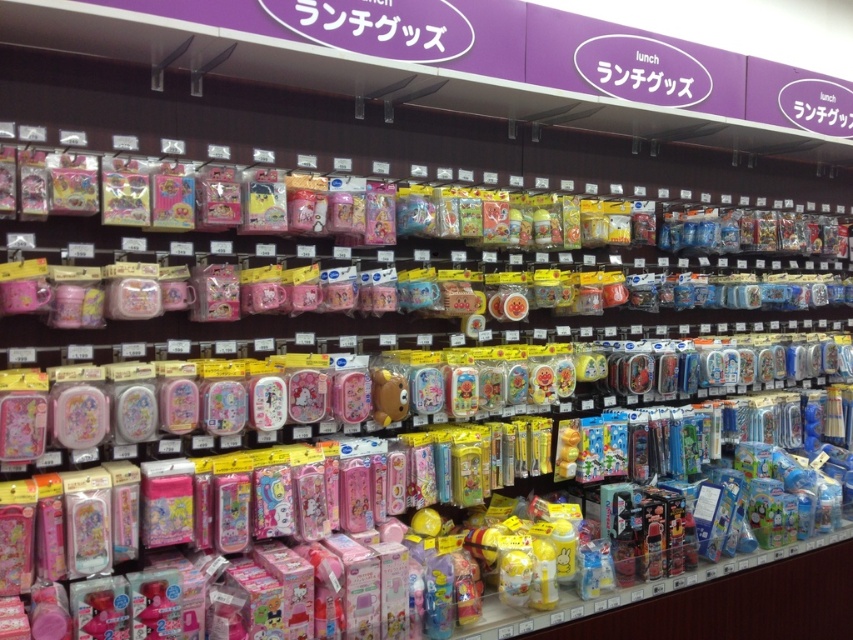
You are organizing a lunchbox and have both a matte brown bear at center and a translucent plastic bear at center. Which bear should you choose if you want the larger one?

The matte brown bear at center is larger in width than the translucent plastic bear at center, so you should choose the matte brown bear at center.

You are a parent shopping for lunch items and see two bears displayed in the lunch goods section. The matte brown bear at center and the translucent plastic bear at center. Which bear is positioned higher on the shelf?

The matte brown bear at center is located above the translucent plastic bear at center, so it is positioned higher on the shelf.

Where is the matte brown bear at center located in the image?

The matte brown bear at center is located at point (387, 396) in the image.